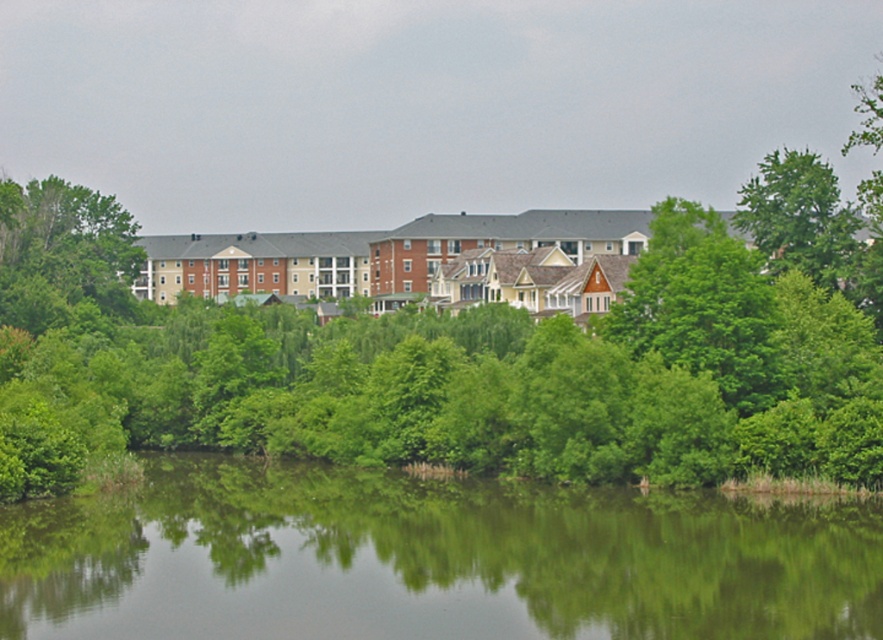
Who is more distant from viewer, (223, 420) or (857, 280)?

Positioned behind is point (857, 280).

Is green leafy tree at center below green leafy tree at upper right?

Indeed, green leafy tree at center is positioned under green leafy tree at upper right.

Is point (95, 332) farther from viewer compared to point (787, 205)?

Yes, point (95, 332) is farther from viewer.

This screenshot has width=883, height=640. Find the location of `green leafy tree at center`. green leafy tree at center is located at coordinates (428, 362).

From the picture: Can you confirm if green reflective water at center is taller than green leafy tree at upper right?

No.

Which of these two, green reflective water at center or green leafy tree at upper right, stands shorter?

green reflective water at center is shorter.

Who is more distant from viewer, (663, 602) or (819, 177)?

The point (819, 177) is behind.

Where is `green reflective water at center`? The image size is (883, 640). green reflective water at center is located at coordinates (x=429, y=557).

Which is more to the right, green leafy tree at center or green reflective water at center?

green leafy tree at center

Is green leafy tree at center behind green reflective water at center?

Yes.

Where is `green leafy tree at center`? green leafy tree at center is located at coordinates (428, 362).

I want to click on green leafy tree at center, so click(428, 362).